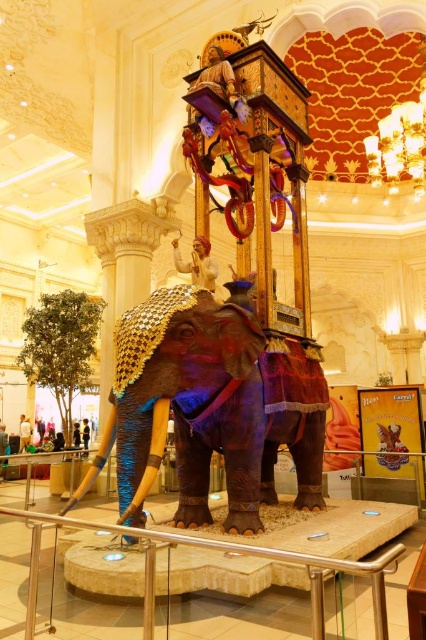
Question: Which point is closer to the camera?

Choices:
 (A) (212, 301)
 (B) (29, 588)

Answer: (B)

Question: Is shiny purple fabric elephant at center positioned in front of satin silver railing at center?

Choices:
 (A) no
 (B) yes

Answer: (A)

Question: Which point appears closest to the camera in this image?

Choices:
 (A) (310, 577)
 (B) (221, 314)

Answer: (A)

Question: Does shiny purple fabric elephant at center lie in front of satin silver railing at center?

Choices:
 (A) yes
 (B) no

Answer: (B)

Question: Is shiny purple fabric elephant at center further to the viewer compared to satin silver railing at center?

Choices:
 (A) yes
 (B) no

Answer: (A)